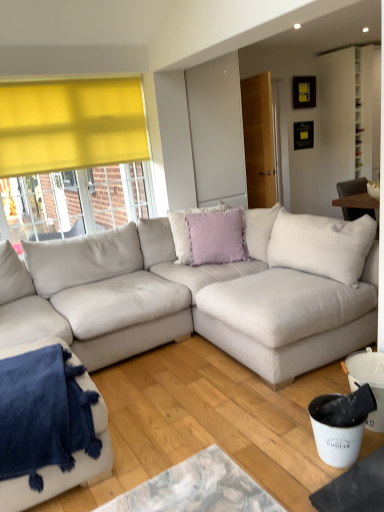
Question: From their relative heights in the image, would you say velvety blue blanket at lower left, which ranks as the 1th studio couch in left-to-right order, is taller or shorter than lavender velvet cushion at center, the first pillow in the front-to-back sequence?

Choices:
 (A) short
 (B) tall

Answer: (A)

Question: Is velvety blue blanket at lower left, which ranks as the 1th studio couch in left-to-right order, to the left or to the right of lavender velvet cushion at center, the first pillow in the front-to-back sequence, in the image?

Choices:
 (A) right
 (B) left

Answer: (B)

Question: Based on their relative distances, which object is farther from the lavender velvet pillow at center, marked as the 1th pillow in a back-to-front arrangement?

Choices:
 (A) velvety blue blanket at lower left, which is the 2th studio couch in right-to-left order
 (B) lavender velvet cushion at center, the first pillow in the front-to-back sequence
 (C) suede-like beige couch at center, the second studio couch from the left

Answer: (A)

Question: Which object is the farthest from the velvety blue blanket at lower left, which ranks as the 1th studio couch in left-to-right order?

Choices:
 (A) lavender velvet cushion at center, the second pillow positioned from the back
 (B) lavender velvet pillow at center, which ranks as the second pillow in front-to-back order
 (C) suede-like beige couch at center, the second studio couch from the left

Answer: (B)